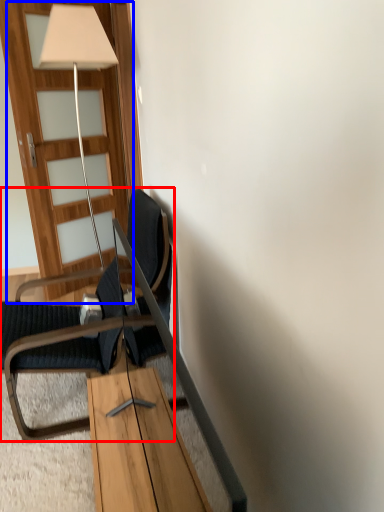
Question: Which object is closer to the camera taking this photo, chair (highlighted by a red box) or door (highlighted by a blue box)?

Choices:
 (A) chair
 (B) door

Answer: (A)